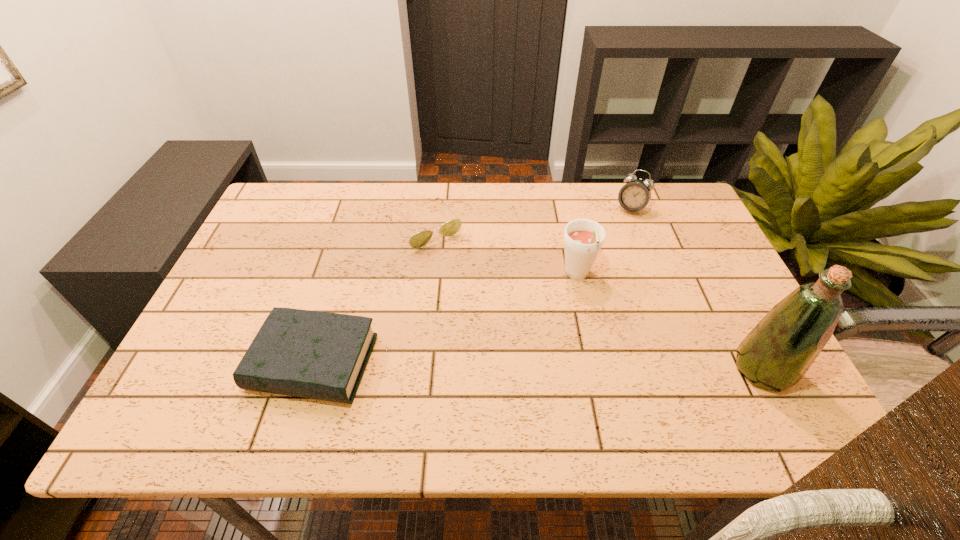
I want to click on vacant point at the right edge, so click(x=692, y=279).

I want to click on free space at the far right corner of the desktop, so click(663, 227).

The height and width of the screenshot is (540, 960). Find the location of `vacant space that's between the Bible and the rightmost object`. vacant space that's between the Bible and the rightmost object is located at coordinates (539, 366).

I want to click on vacant area between the third object from right to left and the Bible, so click(445, 320).

Locate an element on the screen. vacant area that lies between the rightmost object and the root beer is located at coordinates (670, 323).

I want to click on free space between the sunglasses and the third nearest object, so click(501, 252).

You are a GUI agent. You are given a task and a screenshot of the screen. Output one action in this format:
    pyautogui.click(x=<x>, y=<y>)
    Task: Click on the vacant region between the Bible and the tallest object
    
    Given the screenshot: What is the action you would take?
    pyautogui.click(x=539, y=366)

This screenshot has height=540, width=960. Find the location of `vacant area between the root beer and the shortest object`. vacant area between the root beer and the shortest object is located at coordinates (x=501, y=252).

You are a GUI agent. You are given a task and a screenshot of the screen. Output one action in this format:
    pyautogui.click(x=<x>, y=<y>)
    Task: Click on the free space between the root beer and the fourth object from left to right
    
    Given the screenshot: What is the action you would take?
    pyautogui.click(x=604, y=242)

Identify the location of unoccupied area between the olive oil and the alarm clock. The width and height of the screenshot is (960, 540). click(697, 289).